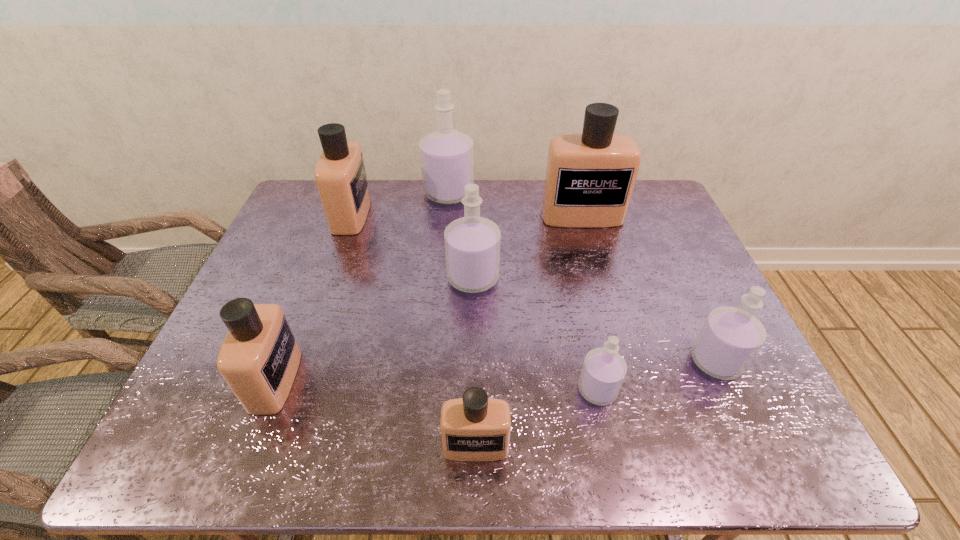
Locate an element on the screen. This screenshot has width=960, height=540. free space between the nearest perfume and the rightmost beige perfume is located at coordinates (529, 331).

Find the location of a particular element. The height and width of the screenshot is (540, 960). free spot between the smallest beige perfume and the second biggest beige perfume is located at coordinates (414, 330).

Locate an element on the screen. The height and width of the screenshot is (540, 960). blank region between the smallest purple perfume and the third farthest beige perfume is located at coordinates (437, 385).

The height and width of the screenshot is (540, 960). Identify the location of empty space between the third biggest beige perfume and the biggest beige perfume. (429, 298).

Identify the location of blank region between the third farthest beige perfume and the third purple perfume from left to right. (437, 385).

Find the location of `free space between the second purple perfume from right to left and the rightmost purple perfume`. free space between the second purple perfume from right to left and the rightmost purple perfume is located at coordinates (657, 375).

Locate an element on the screen. Image resolution: width=960 pixels, height=540 pixels. object that can be found as the seventh closest to the smallest purple perfume is located at coordinates (340, 175).

Locate which object ranks third in proximity to the second nearest beige perfume. Please provide its 2D coordinates. Your answer should be formatted as a tuple, i.e. [(x, y)], where the tuple contains the x and y coordinates of a point satisfying the conditions above.

[(340, 175)]

Choose which perfume is the second nearest neighbor to the nearest perfume. Please provide its 2D coordinates. Your answer should be formatted as a tuple, i.e. [(x, y)], where the tuple contains the x and y coordinates of a point satisfying the conditions above.

[(259, 358)]

Identify which perfume is the sixth nearest to the fourth farthest perfume. Please provide its 2D coordinates. Your answer should be formatted as a tuple, i.e. [(x, y)], where the tuple contains the x and y coordinates of a point satisfying the conditions above.

[(474, 428)]